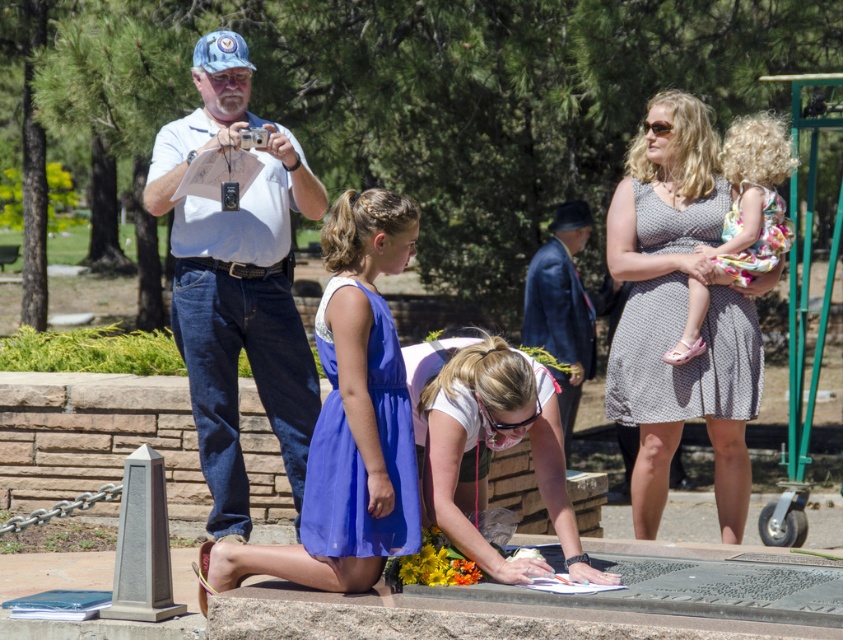
Question: Does white cotton dress at center have a lesser width compared to blue fabric jacket at center?

Choices:
 (A) no
 (B) yes

Answer: (A)

Question: Which point is farther to the camera?

Choices:
 (A) (245, 304)
 (B) (573, 356)

Answer: (B)

Question: Is blue satin dress at center wider than blue fabric jacket at center?

Choices:
 (A) no
 (B) yes

Answer: (B)

Question: Among these objects, which one is farthest from the camera?

Choices:
 (A) blue fabric jacket at center
 (B) blue satin dress at center
 (C) floral fabric dress at upper right

Answer: (A)

Question: Which object is closer to the camera taking this photo?

Choices:
 (A) white cotton dress at center
 (B) polka dot dress at upper right

Answer: (A)

Question: Can you confirm if polka dot dress at upper right is smaller than blue satin dress at center?

Choices:
 (A) yes
 (B) no

Answer: (B)